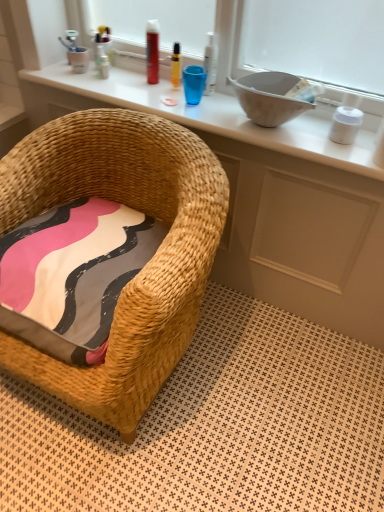
Where is `empty space that is ontop of woven straw chair at lower left (from a real-world perspective)`? This screenshot has width=384, height=512. empty space that is ontop of woven straw chair at lower left (from a real-world perspective) is located at coordinates (204, 415).